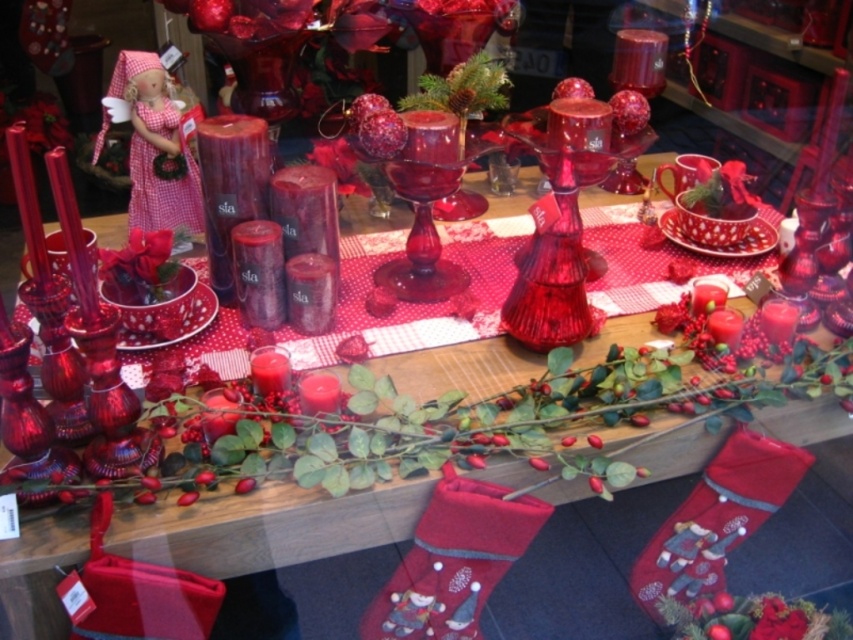
You are a customer looking at the festive display. You want to place a gift under the velvet red stocking at lower right. Where should you look for the pink gingham doll at upper left in relation to the stocking?

The pink gingham doll at upper left is to the left of the velvet red stocking at lower right.

You are standing in front of the festive display and want to know how far the point at coordinates (460, 536) is from your eyes. Can you determine the distance?

The point at coordinates (460, 536) is 95.53 centimeters away from the camera, so the distance from your eyes would be approximately 95.53 centimeters.